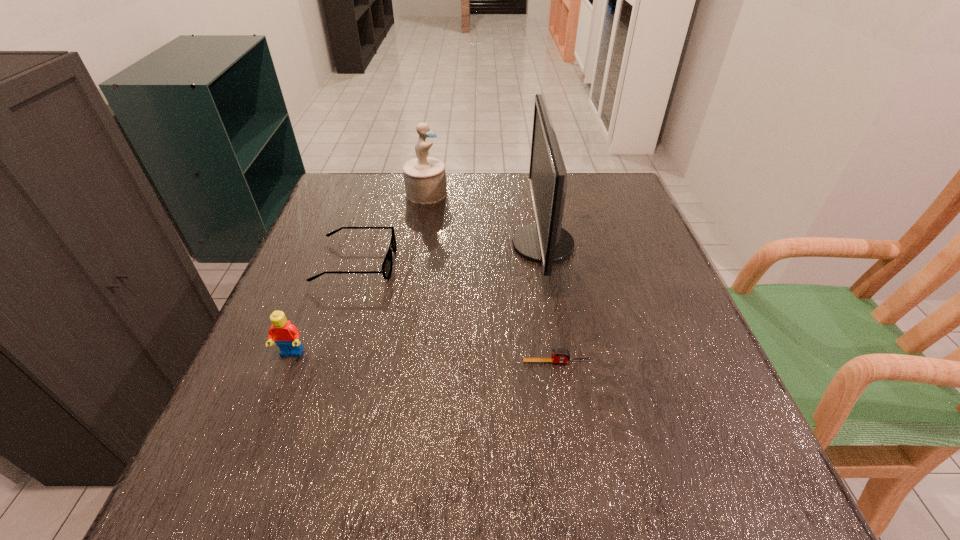
Where is `monitor`? Image resolution: width=960 pixels, height=540 pixels. monitor is located at coordinates (545, 241).

You are a GUI agent. You are given a task and a screenshot of the screen. Output one action in this format:
    pyautogui.click(x=<x>, y=<y>)
    Task: Click on the figurine
    
    Given the screenshot: What is the action you would take?
    pyautogui.click(x=425, y=178)

This screenshot has width=960, height=540. What are the coordinates of `Lego` in the screenshot? It's located at (286, 335).

This screenshot has height=540, width=960. Identify the location of the second shortest object. (387, 265).

Locate an element on the screen. This screenshot has height=540, width=960. the shortest object is located at coordinates (559, 355).

You are a GUI agent. You are given a task and a screenshot of the screen. Output one action in this format:
    pyautogui.click(x=<x>, y=<y>)
    Task: Click on the vacant point located on the screen side of the tallest object
    
    Given the screenshot: What is the action you would take?
    pyautogui.click(x=400, y=244)

Where is `vacant space located 0.300m on the screen side of the tallest object`? vacant space located 0.300m on the screen side of the tallest object is located at coordinates (388, 244).

This screenshot has height=540, width=960. I want to click on vacant region located on the screen side of the tallest object, so click(x=392, y=244).

The width and height of the screenshot is (960, 540). What are the coordinates of `free spot located at the beak of the figurine` in the screenshot? It's located at (564, 193).

This screenshot has width=960, height=540. Identify the location of blank space located 0.220m on the face of the Lego. (240, 483).